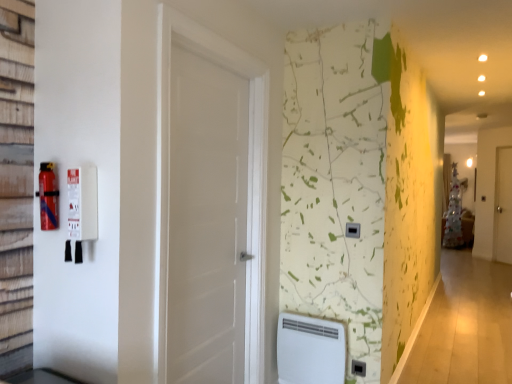
Question: Considering the relative sizes of black plastic electric outlet at center and white matte door at center, acting as the 1th door starting from the left, in the image provided, is black plastic electric outlet at center thinner than white matte door at center, acting as the 1th door starting from the left,?

Choices:
 (A) no
 (B) yes

Answer: (B)

Question: Is black plastic electric outlet at center far away from white matte door at center, the 2th door positioned from the right?

Choices:
 (A) no
 (B) yes

Answer: (B)

Question: Would you say black plastic electric outlet at center is outside white matte door at center, acting as the 1th door starting from the left?

Choices:
 (A) no
 (B) yes

Answer: (B)

Question: Does black plastic electric outlet at center have a greater width compared to white matte door at center, acting as the 1th door starting from the left?

Choices:
 (A) no
 (B) yes

Answer: (A)

Question: Considering the relative sizes of black plastic electric outlet at center and white matte door at center, acting as the 1th door starting from the left, in the image provided, is black plastic electric outlet at center smaller than white matte door at center, acting as the 1th door starting from the left,?

Choices:
 (A) no
 (B) yes

Answer: (B)

Question: Based on their sizes in the image, would you say white matte door at center, the 2th door positioned from the right, is bigger or smaller than white plastic water heater at lower center?

Choices:
 (A) big
 (B) small

Answer: (A)

Question: From a real-world perspective, is white matte door at center, the first door when ordered from front to back, positioned above or below white plastic water heater at lower center?

Choices:
 (A) below
 (B) above

Answer: (B)

Question: Based on their positions, is white matte door at center, acting as the 1th door starting from the left, located to the left or right of white plastic water heater at lower center?

Choices:
 (A) right
 (B) left

Answer: (B)

Question: Is white matte door at center, the first door when ordered from front to back, wider or thinner than white plastic water heater at lower center?

Choices:
 (A) wide
 (B) thin

Answer: (B)

Question: In terms of width, does white wooden door at right, marked as the 2th door in a front-to-back arrangement, look wider or thinner when compared to red matte fire extinguisher at left?

Choices:
 (A) wide
 (B) thin

Answer: (A)

Question: Is white wooden door at right, which is the first door from back to front, inside the boundaries of red matte fire extinguisher at left, or outside?

Choices:
 (A) outside
 (B) inside

Answer: (A)

Question: From their relative heights in the image, would you say white wooden door at right, marked as the 2th door in a front-to-back arrangement, is taller or shorter than red matte fire extinguisher at left?

Choices:
 (A) short
 (B) tall

Answer: (B)

Question: From the image's perspective, is white wooden door at right, which is the first door from back to front, located above or below red matte fire extinguisher at left?

Choices:
 (A) below
 (B) above

Answer: (A)

Question: Considering their positions, is white wooden door at right, the second door in the left-to-right sequence, located in front of or behind black plastic/light switch at center-right?

Choices:
 (A) behind
 (B) front

Answer: (A)

Question: Looking at the image, does white wooden door at right, marked as the 2th door in a front-to-back arrangement, seem bigger or smaller compared to black plastic/light switch at center-right?

Choices:
 (A) big
 (B) small

Answer: (A)